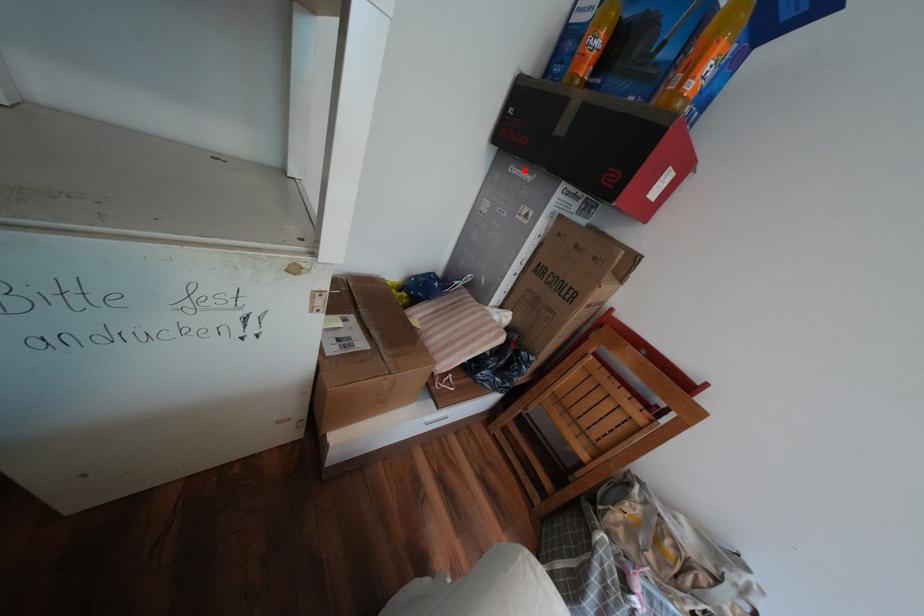
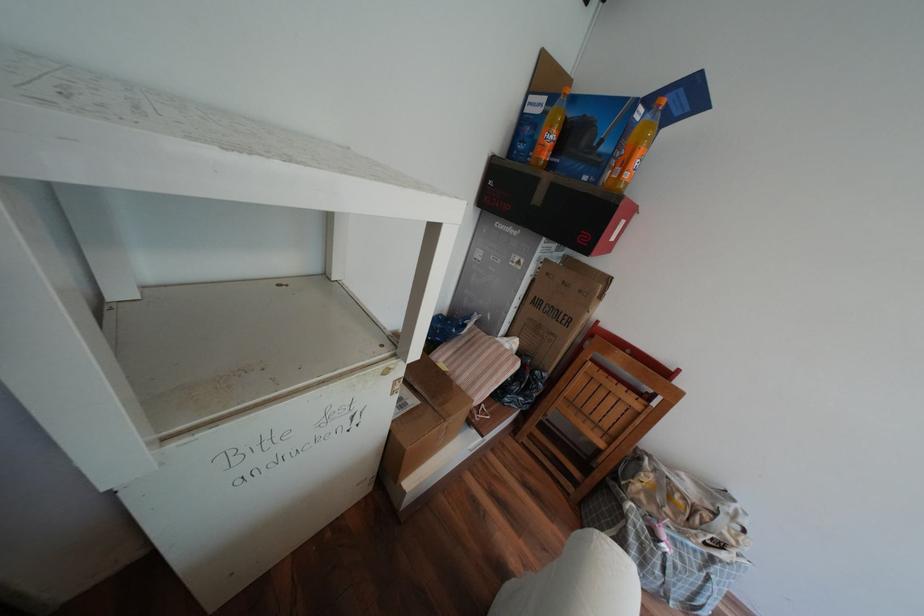
Locate, in the second image, the point that corresponds to the highlighted location in the first image.

(511, 225)